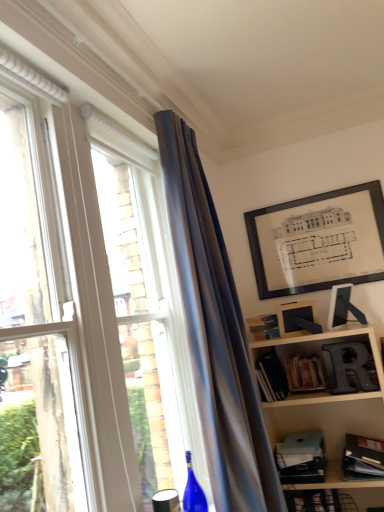
Question: From a real-world perspective, is hardcover books at lower right, acting as the second book starting from the left, physically below metallic silver letter r at lower right?

Choices:
 (A) yes
 (B) no

Answer: (A)

Question: Does hardcover books at lower right, acting as the second book starting from the left, have a smaller size compared to metallic silver letter r at lower right?

Choices:
 (A) yes
 (B) no

Answer: (B)

Question: Considering the relative positions of hardcover books at lower right, acting as the second book starting from the left, and metallic silver letter r at lower right in the image provided, is hardcover books at lower right, acting as the second book starting from the left, behind metallic silver letter r at lower right?

Choices:
 (A) no
 (B) yes

Answer: (B)

Question: Are hardcover books at lower right, placed as the 1th book when sorted from top to bottom, and metallic silver letter r at lower right beside each other?

Choices:
 (A) no
 (B) yes

Answer: (A)

Question: Considering the relative positions of hardcover books at lower right, the second book positioned from the right, and metallic silver letter r at lower right in the image provided, is hardcover books at lower right, the second book positioned from the right, to the left of metallic silver letter r at lower right from the viewer's perspective?

Choices:
 (A) no
 (B) yes

Answer: (B)

Question: From a real-world perspective, is hardcover books at lower right, acting as the second book starting from the left, on top of metallic silver letter r at lower right?

Choices:
 (A) yes
 (B) no

Answer: (B)

Question: Is metallic silver letter r at lower right not inside blue glass wine bottle at lower center?

Choices:
 (A) yes
 (B) no

Answer: (A)

Question: Is metallic silver letter r at lower right facing away from blue glass wine bottle at lower center?

Choices:
 (A) yes
 (B) no

Answer: (B)

Question: Is blue glass wine bottle at lower center a part of metallic silver letter r at lower right?

Choices:
 (A) yes
 (B) no

Answer: (B)

Question: Does metallic silver letter r at lower right appear on the left side of blue glass wine bottle at lower center?

Choices:
 (A) no
 (B) yes

Answer: (A)

Question: From a real-world perspective, is metallic silver letter r at lower right on top of blue glass wine bottle at lower center?

Choices:
 (A) no
 (B) yes

Answer: (B)

Question: From the image's perspective, is metallic silver letter r at lower right under blue glass wine bottle at lower center?

Choices:
 (A) no
 (B) yes

Answer: (A)

Question: From a real-world perspective, is blue glass wine bottle at lower center positioned under matte glass window at left based on gravity?

Choices:
 (A) yes
 (B) no

Answer: (A)